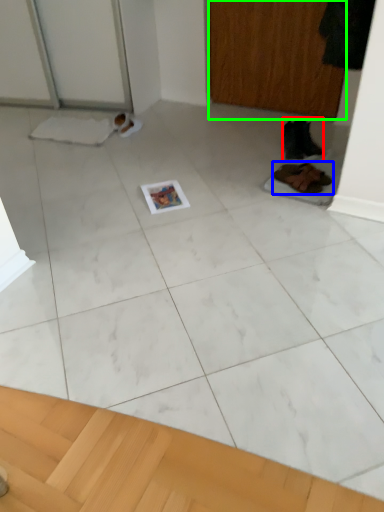
Question: Which object is the closest to the footwear (highlighted by a red box)? Choose among these: footwear (highlighted by a blue box) or screen door (highlighted by a green box).

Choices:
 (A) footwear
 (B) screen door

Answer: (A)